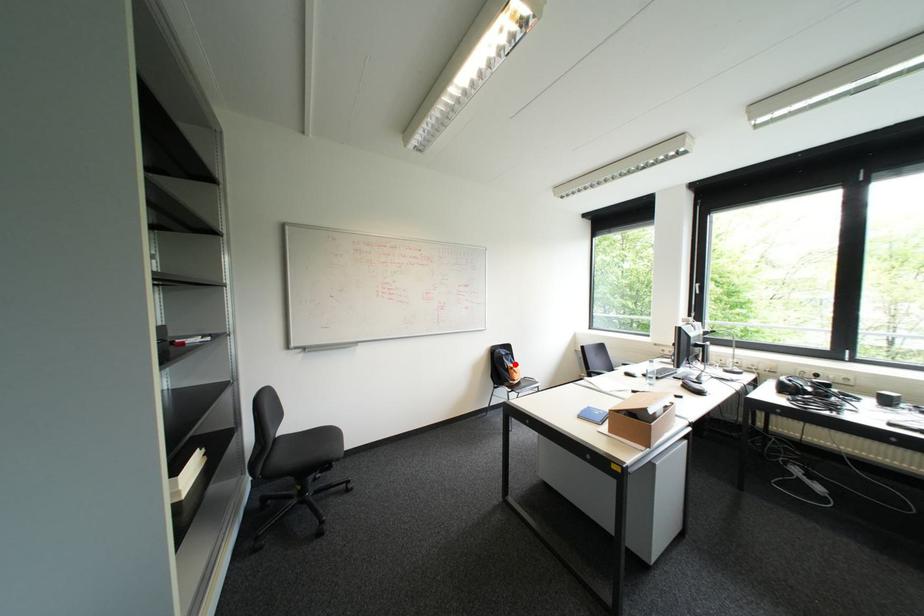
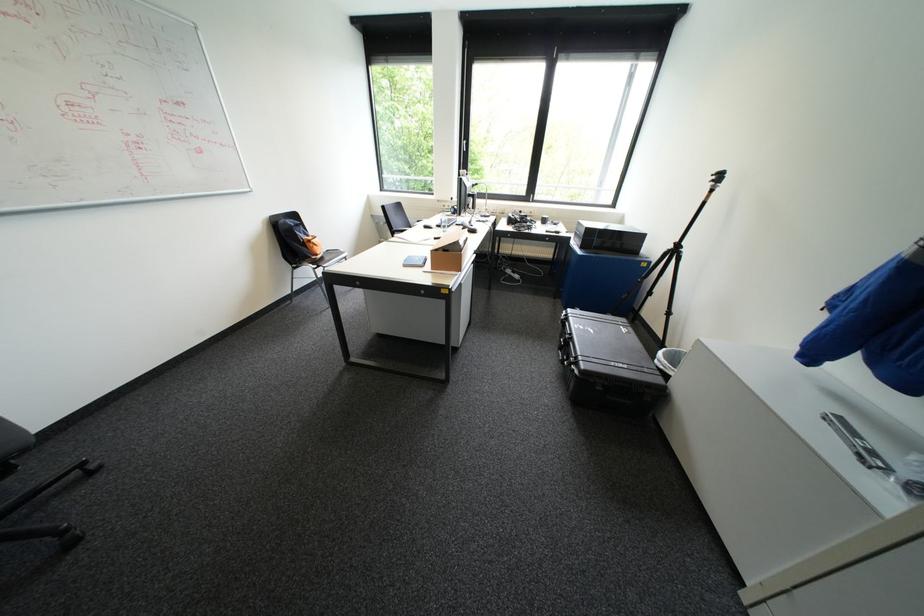
Find the pixel in the second image that matches the highlighted location in the first image.

(310, 237)